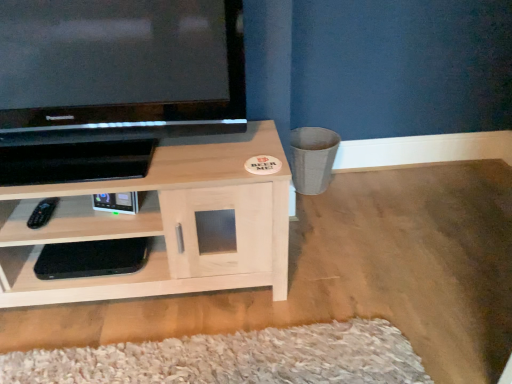
Question: From the image's perspective, is light wood/woodenobject at lower left, the 1th shelf from the top, located above or below black glossy television at upper left?

Choices:
 (A) below
 (B) above

Answer: (A)

Question: Relative to black glossy television at upper left, is light wood/woodenobject at lower left, the 1th shelf from the top, in front or behind?

Choices:
 (A) front
 (B) behind

Answer: (B)

Question: Which of these objects is positioned farthest from the black plastic remote at lower left?

Choices:
 (A) black matte console at lower left, marked as the first shelf in a bottom-to-top arrangement
 (B) black glossy television at upper left
 (C) light wood/woodenobject at lower left, the 1th shelf from the top

Answer: (B)

Question: Which is nearer to the black matte console at lower left, marked as the first shelf in a bottom-to-top arrangement?

Choices:
 (A) light wood/woodenobject at lower left, the 1th shelf from the top
 (B) black plastic remote at lower left
 (C) black glossy television at upper left

Answer: (A)